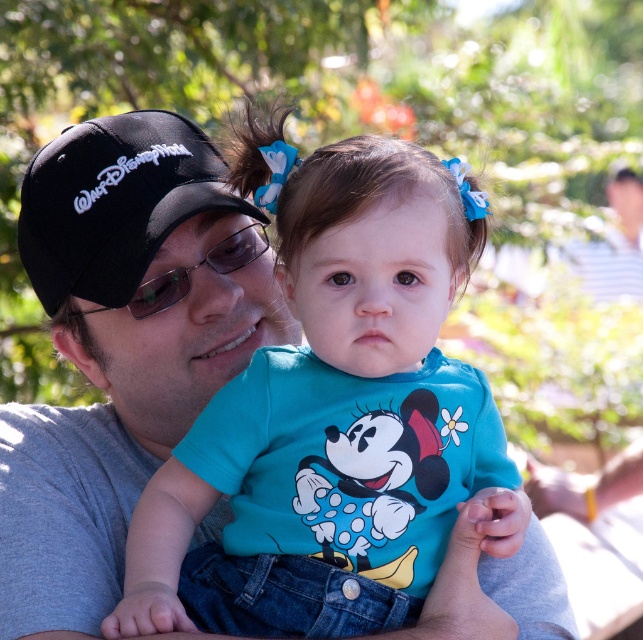
Question: Which object is positioned farthest from the sunglasses at center?

Choices:
 (A) black fabric baseball cap at left
 (B) turquoise fabric shirt at center

Answer: (B)

Question: From the image, what is the correct spatial relationship of turquoise fabric shirt at center in relation to black fabric baseball cap at left?

Choices:
 (A) right
 (B) left

Answer: (A)

Question: Is the position of black fabric baseball cap at left less distant than that of sunglasses at center?

Choices:
 (A) yes
 (B) no

Answer: (A)

Question: Which point is farther from the camera taking this photo?

Choices:
 (A) (253, 232)
 (B) (73, 280)

Answer: (A)

Question: Which point appears closest to the camera in this image?

Choices:
 (A) (242, 246)
 (B) (127, 193)

Answer: (B)

Question: Can you confirm if turquoise fabric shirt at center is wider than sunglasses at center?

Choices:
 (A) yes
 (B) no

Answer: (A)